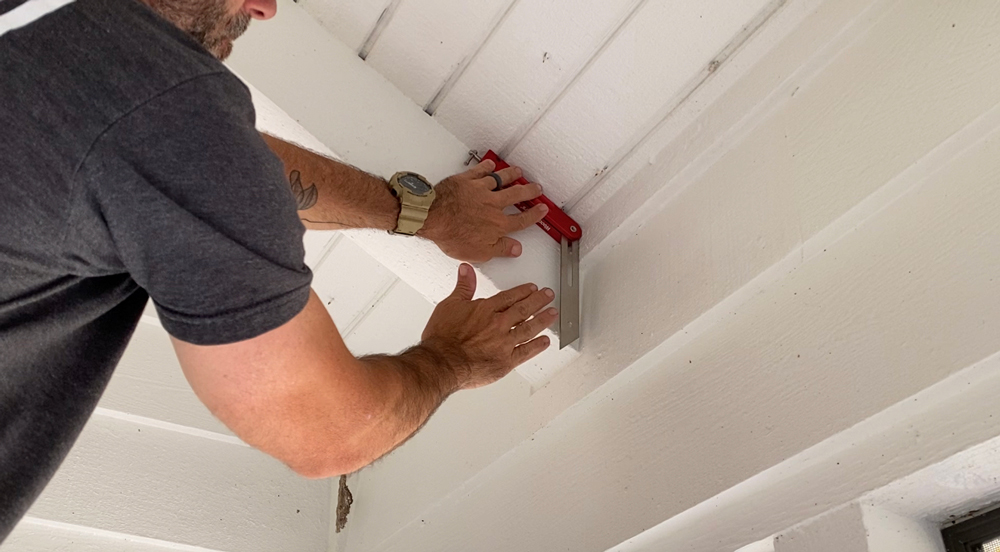
Locate an element on the screen. The height and width of the screenshot is (552, 1000). wood beam is located at coordinates (372, 137).